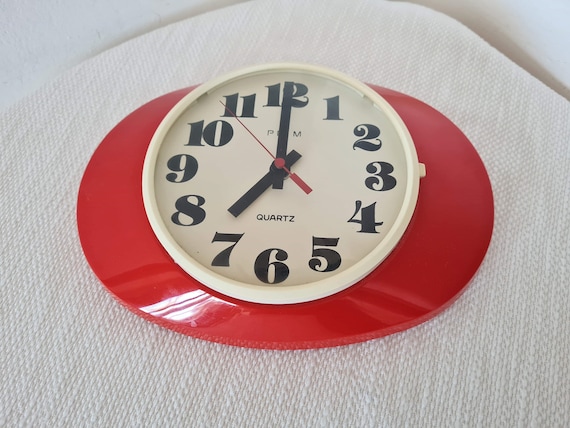
I want to click on clock base, so click(136, 246).